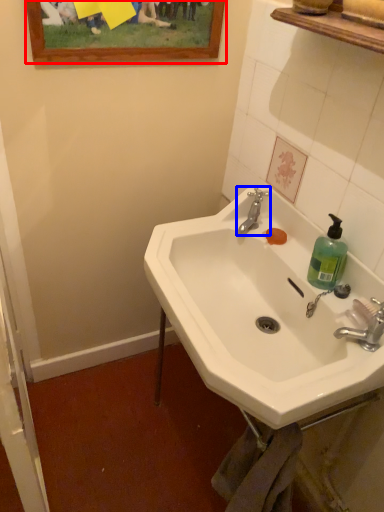
Question: Which object appears closest to the camera in this image, picture frame (highlighted by a red box) or tap (highlighted by a blue box)?

Choices:
 (A) picture frame
 (B) tap

Answer: (A)